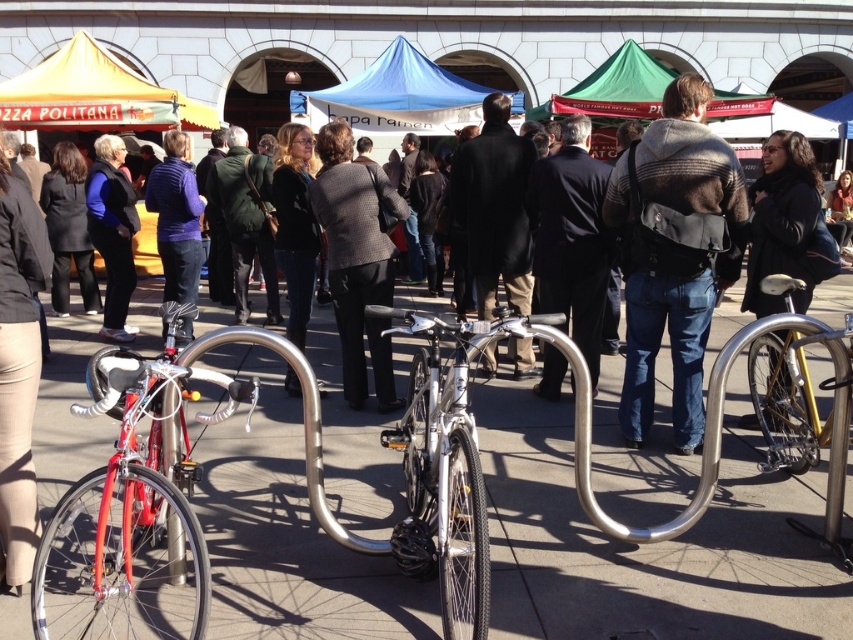
Is dark gray sweater at center to the right of purple fleece jacket at center from the viewer's perspective?

Correct, you'll find dark gray sweater at center to the right of purple fleece jacket at center.

Can you confirm if dark gray sweater at center is positioned to the left of purple fleece jacket at center?

In fact, dark gray sweater at center is to the right of purple fleece jacket at center.

Is point (798, 259) less distant than point (189, 339)?

No, it is not.

This screenshot has height=640, width=853. I want to click on dark gray sweater at center, so click(782, 220).

Between dark gray knitted sweater at center and dark gray sweater at center, which one is positioned higher?

dark gray sweater at center is above.

Is point (694, 129) positioned behind point (770, 161)?

No, (694, 129) is closer to viewer.

Where is `dark gray knitted sweater at center`? Image resolution: width=853 pixels, height=640 pixels. dark gray knitted sweater at center is located at coordinates (672, 256).

Which of these two, dark gray knitted sweater at center or matte black jacket at center, stands shorter?

matte black jacket at center

Is dark gray knitted sweater at center above matte black jacket at center?

No, dark gray knitted sweater at center is not above matte black jacket at center.

The height and width of the screenshot is (640, 853). Find the location of `dark gray knitted sweater at center`. dark gray knitted sweater at center is located at coordinates (672, 256).

The height and width of the screenshot is (640, 853). Identify the location of dark gray knitted sweater at center. (672, 256).